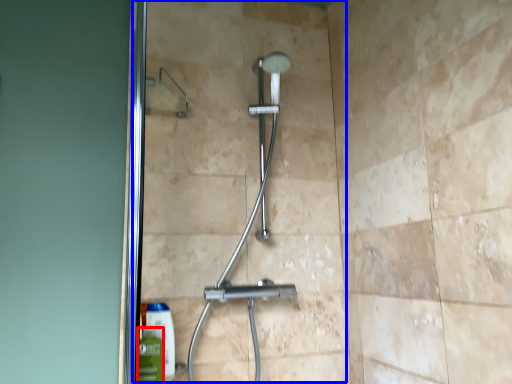
Question: Among these objects, which one is farthest to the camera, mouthwash (highlighted by a red box) or glass door (highlighted by a blue box)?

Choices:
 (A) mouthwash
 (B) glass door

Answer: (B)